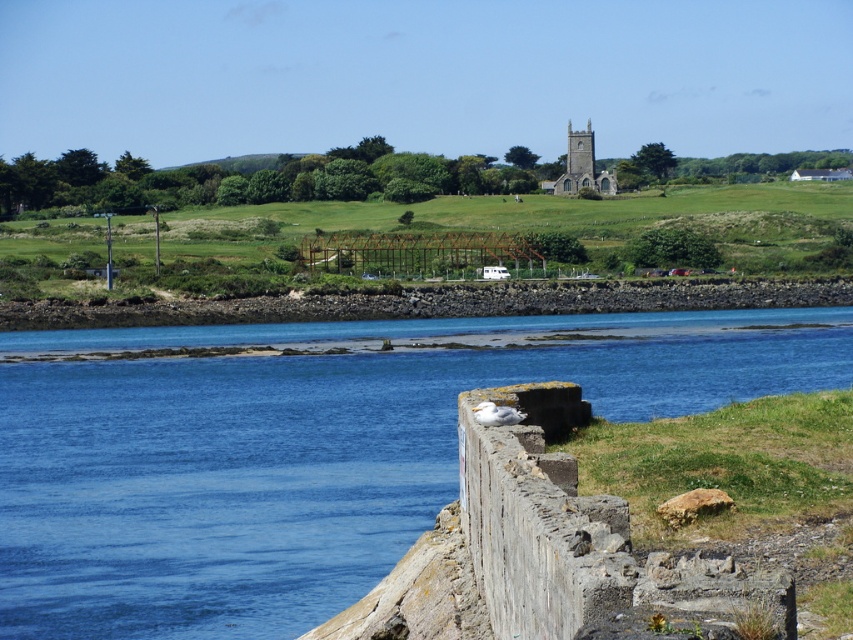
Can you confirm if blue water at center is thinner than stone church steeple at upper center?

In fact, blue water at center might be wider than stone church steeple at upper center.

Between point (717, 404) and point (579, 157), which one is positioned in front?

Positioned in front is point (717, 404).

Who is more forward, (798, 310) or (590, 138)?

Point (798, 310) is more forward.

You are a GUI agent. You are given a task and a screenshot of the screen. Output one action in this format:
    pyautogui.click(x=<x>, y=<y>)
    Task: Click on the blue water at center
    The width and height of the screenshot is (853, 640).
    Given the screenshot: What is the action you would take?
    pyautogui.click(x=306, y=452)